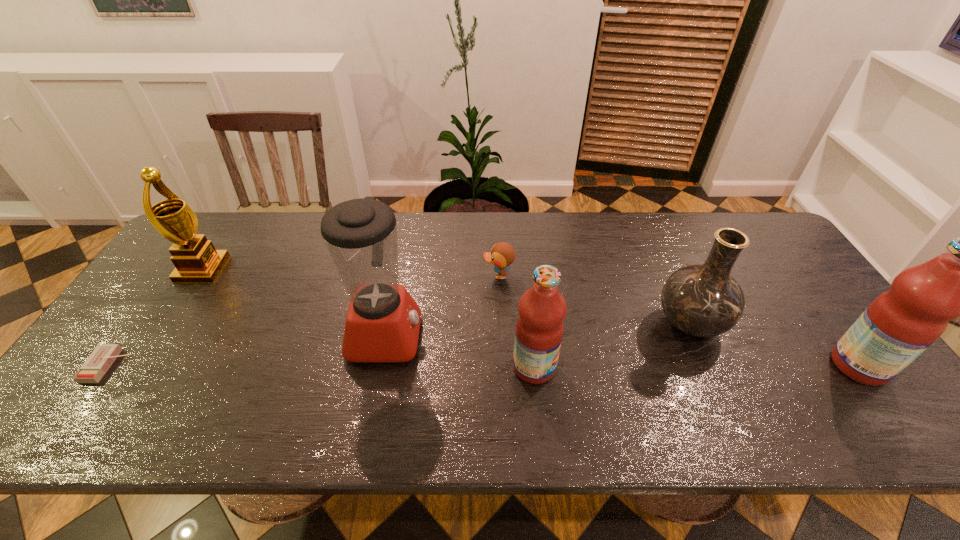
This screenshot has height=540, width=960. I want to click on the shorter fruit juice, so click(x=542, y=309).

What are the coordinates of `the right fruit juice` in the screenshot? It's located at (901, 323).

Where is `the taller fruit juice`? The height and width of the screenshot is (540, 960). the taller fruit juice is located at coordinates point(901,323).

You are a GUI agent. You are given a task and a screenshot of the screen. Output one action in this format:
    pyautogui.click(x=<x>, y=<y>)
    Task: Click on the second shortest object
    The height and width of the screenshot is (540, 960).
    Given the screenshot: What is the action you would take?
    pyautogui.click(x=502, y=255)

Locate an element on the screen. The height and width of the screenshot is (540, 960). award is located at coordinates (196, 260).

At what (x,y) coordinates should I click in order to perform the action: click on vase. Please return your answer as a coordinate pair (x, y). Looking at the image, I should click on click(x=703, y=300).

You are a GUI agent. You are given a task and a screenshot of the screen. Output one action in this format:
    pyautogui.click(x=<x>, y=<y>)
    Task: Click on the blender
    The image size is (960, 540).
    Given the screenshot: What is the action you would take?
    pyautogui.click(x=382, y=325)

Locate an element on the screen. the shortest object is located at coordinates (99, 361).

The width and height of the screenshot is (960, 540). Identify the location of vacant space located on the front label of the shorter fruit juice. (680, 367).

Identify the location of free space located on the front-facing side of the duck. (368, 276).